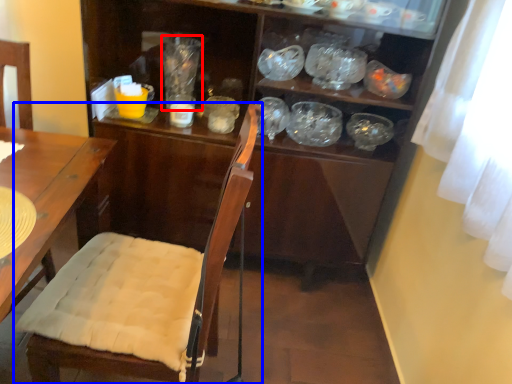
Question: Which point is further to the camera, glass jar (highlighted by a red box) or chair (highlighted by a blue box)?

Choices:
 (A) glass jar
 (B) chair

Answer: (A)